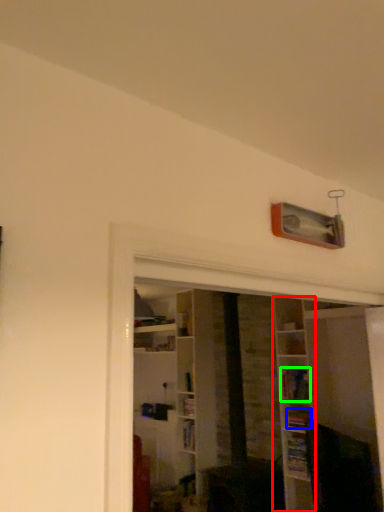
Question: Which is nearer to the shelf (highlighted by a red box)? book (highlighted by a blue box) or book (highlighted by a green box).

Choices:
 (A) book
 (B) book

Answer: (B)